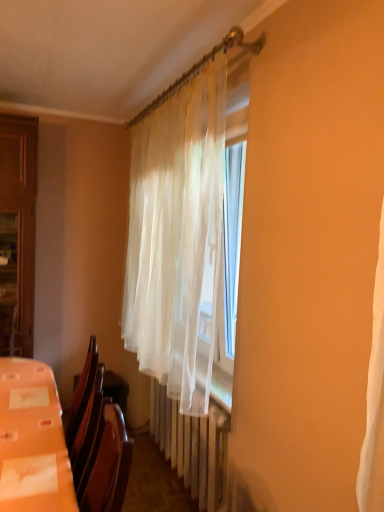
The image size is (384, 512). What do you see at coordinates (177, 238) in the screenshot? I see `translucent white curtain at center` at bounding box center [177, 238].

Measure the distance between point [212,334] and camera.

The distance of point [212,334] from camera is 5.87 feet.

The height and width of the screenshot is (512, 384). Find the location of `white plastic radiator at center`. white plastic radiator at center is located at coordinates (193, 446).

What do you see at coordinates (32, 440) in the screenshot?
I see `orange plastic table at lower left` at bounding box center [32, 440].

Image resolution: width=384 pixels, height=512 pixels. I want to click on translucent white curtain at center, so click(177, 238).

Which of these two, orange plastic table at lower left or translucent white curtain at center, is bigger?

With larger size is translucent white curtain at center.

Identify the location of curtain behind the orange plastic table at lower left. Image resolution: width=384 pixels, height=512 pixels. (177, 238).

Is orange plastic table at lower left further to camera compared to translucent white curtain at center?

No, orange plastic table at lower left is closer to the viewer.

Is white plastic radiator at center not within translucent white curtain at center?

Yes, white plastic radiator at center is located beyond the bounds of translucent white curtain at center.

Is point (211, 487) positioned behind point (151, 165)?

No.

Between white plastic radiator at center and translucent white curtain at center, which one appears on the right side from the viewer's perspective?

white plastic radiator at center.

Is white plastic radiator at center further to the viewer compared to translucent white curtain at center?

Yes, the depth of white plastic radiator at center is greater than that of translucent white curtain at center.

Find the location of `table located below the translucent white curtain at center (from the image's perspective)`. table located below the translucent white curtain at center (from the image's perspective) is located at coordinates (32, 440).

Does translucent white curtain at center touch orange plastic table at lower left?

No.

Considering the sizes of objects translucent white curtain at center and orange plastic table at lower left in the image provided, who is shorter, translucent white curtain at center or orange plastic table at lower left?

Standing shorter between the two is orange plastic table at lower left.

Is orange plastic table at lower left a part of translucent white curtain at center?

That's incorrect, orange plastic table at lower left is not inside translucent white curtain at center.

Considering the sizes of objects orange plastic table at lower left and white plastic radiator at center in the image provided, who is taller, orange plastic table at lower left or white plastic radiator at center?

white plastic radiator at center is taller.

Based on the photo, from the image's perspective, does orange plastic table at lower left appear lower than white plastic radiator at center?

No.

Is orange plastic table at lower left positioned in front of white plastic radiator at center?

Yes.

From a real-world perspective, who is located lower, translucent white curtain at center or white plastic radiator at center?

white plastic radiator at center, from a real-world perspective.

Is translucent white curtain at center spatially inside white plastic radiator at center, or outside of it?

translucent white curtain at center is located beyond the bounds of white plastic radiator at center.

Is translucent white curtain at center closer to camera compared to white plastic radiator at center?

Yes, it is in front of white plastic radiator at center.

From the image's perspective, is translucent white curtain at center over white plastic radiator at center?

Yes, from the image's perspective, translucent white curtain at center is above white plastic radiator at center.

Is there a large distance between white plastic radiator at center and orange plastic table at lower left?

white plastic radiator at center is actually quite close to orange plastic table at lower left.

Can you confirm if white plastic radiator at center is bigger than orange plastic table at lower left?

Yes, white plastic radiator at center is bigger than orange plastic table at lower left.

Does white plastic radiator at center have a greater width compared to orange plastic table at lower left?

No.

From the image's perspective, is white plastic radiator at center located above orange plastic table at lower left?

No, from the image's perspective, white plastic radiator at center is not over orange plastic table at lower left.

In order to click on curtain on the right of orange plastic table at lower left in this screenshot , I will do `click(177, 238)`.

You are a GUI agent. You are given a task and a screenshot of the screen. Output one action in this format:
    pyautogui.click(x=<x>, y=<y>)
    Task: Click on the curtain that appears above the white plastic radiator at center (from the image's perspective)
    
    Given the screenshot: What is the action you would take?
    pyautogui.click(x=177, y=238)

From the image, which object appears to be farther from white plastic radiator at center, orange plastic table at lower left or translucent white curtain at center?

The object further to white plastic radiator at center is orange plastic table at lower left.

When comparing their distances from translucent white curtain at center, does orange plastic table at lower left or white plastic radiator at center seem further?

orange plastic table at lower left is positioned further to the anchor translucent white curtain at center.

Considering their positions, is translucent white curtain at center positioned further to orange plastic table at lower left than white plastic radiator at center?

Among the two, translucent white curtain at center is located further to orange plastic table at lower left.

From the image, which object appears to be farther from orange plastic table at lower left, white plastic radiator at center or translucent white curtain at center?

Among the two, translucent white curtain at center is located further to orange plastic table at lower left.

When comparing their distances from translucent white curtain at center, does white plastic radiator at center or orange plastic table at lower left seem closer?

white plastic radiator at center is positioned closer to the anchor translucent white curtain at center.

Looking at the image, which one is located further to white plastic radiator at center, translucent white curtain at center or orange plastic table at lower left?

Among the two, orange plastic table at lower left is located further to white plastic radiator at center.

What are the coordinates of `table between translucent white curtain at center and white plastic radiator at center from top to bottom` in the screenshot? It's located at (32, 440).